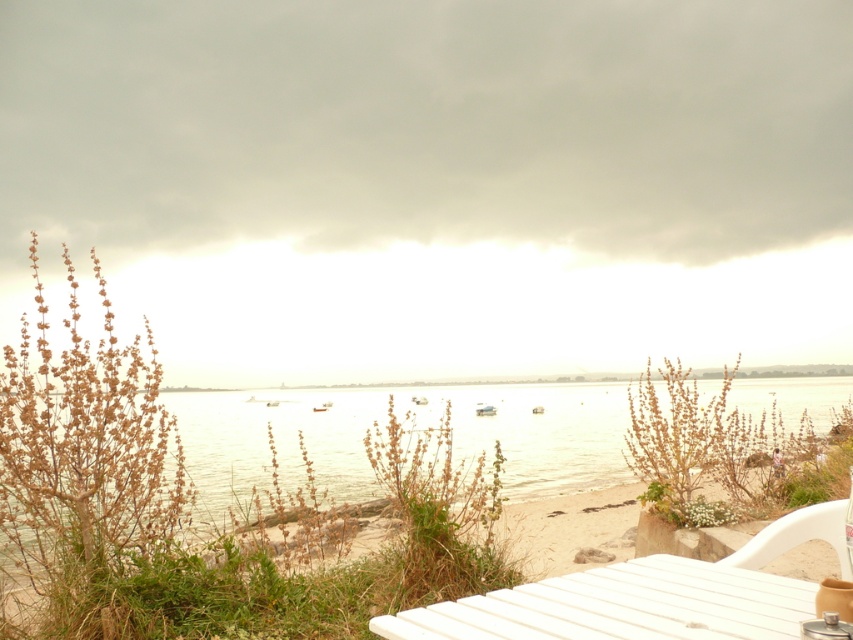
You are a photographer setting up a shot of the coastal scene. You want to ensure the white plastic chair at lower right is in focus while capturing the clear water at center. Given their positions, which object should you adjust your camera focus on first to ensure both are sharp?

The white plastic chair at lower right is behind clear water at center, so you should focus on the white plastic chair at lower right first since it is farther away. This ensures depth of field captures both the foreground and background elements.

What is located at the point with coordinates (421, 428) in the image?

The point at coordinates (421, 428) indicates clear water at center.

From the picture: You are sitting on the white plastic chair at lower right and want to reach the white wood table at lower right to grab a bottle. Is the table within your immediate reach without moving from the chair?

The white wood table at lower right is in front of the white plastic chair at lower right, so yes, the table is within immediate reach from the chair.